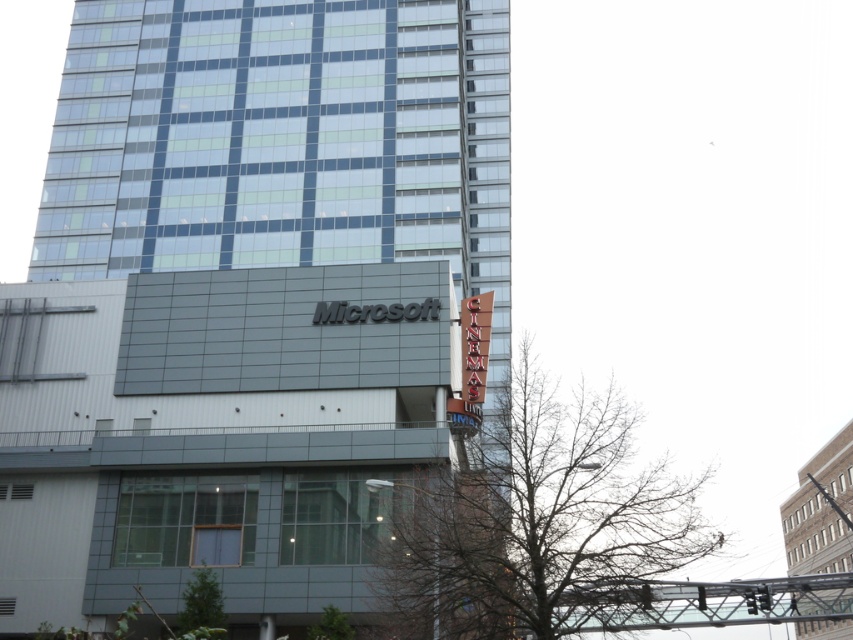
Question: Does glassy steel building at center appear under gray concrete building at right?

Choices:
 (A) yes
 (B) no

Answer: (B)

Question: Among these objects, which one is nearest to the camera?

Choices:
 (A) glassy steel building at center
 (B) gray concrete building at right

Answer: (A)

Question: Does glassy steel building at center come behind gray concrete building at right?

Choices:
 (A) no
 (B) yes

Answer: (A)

Question: Can you confirm if glassy steel building at center is positioned to the left of gray concrete building at right?

Choices:
 (A) yes
 (B) no

Answer: (A)

Question: Which point appears farthest from the camera in this image?

Choices:
 (A) (842, 632)
 (B) (236, 560)

Answer: (A)

Question: Which point appears farthest from the camera in this image?

Choices:
 (A) (788, 513)
 (B) (213, 520)

Answer: (A)